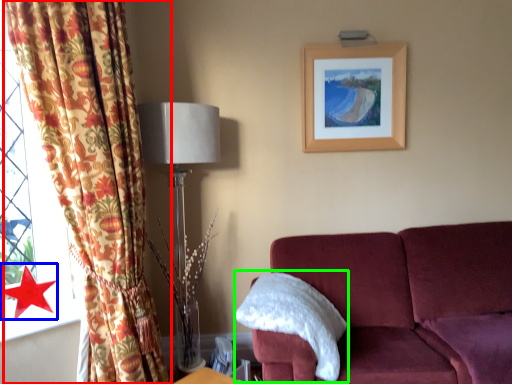
Question: Estimate the real-world distances between objects in this image. Which object is farther from curtain (highlighted by a red box), star (highlighted by a blue box) or pillow (highlighted by a green box)?

Choices:
 (A) star
 (B) pillow

Answer: (B)